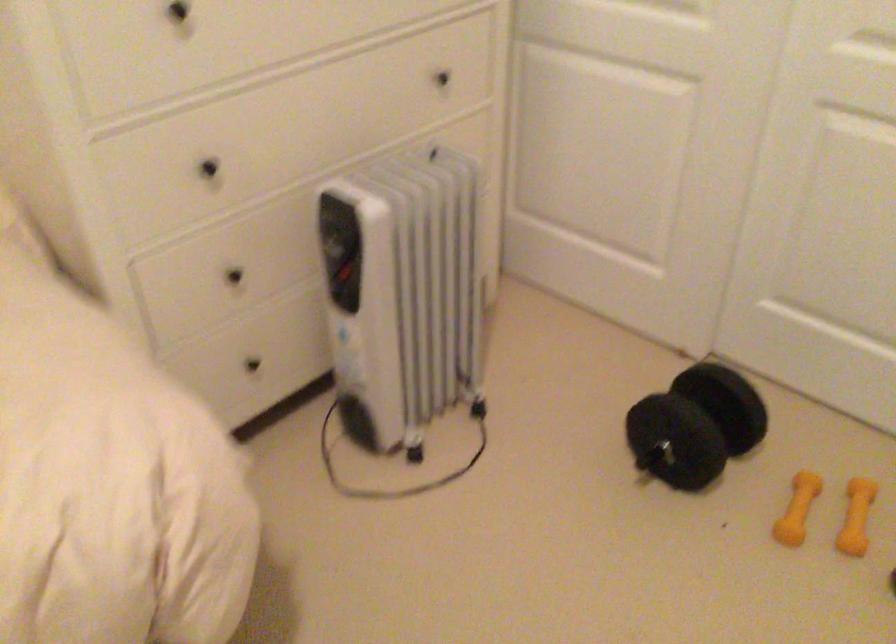
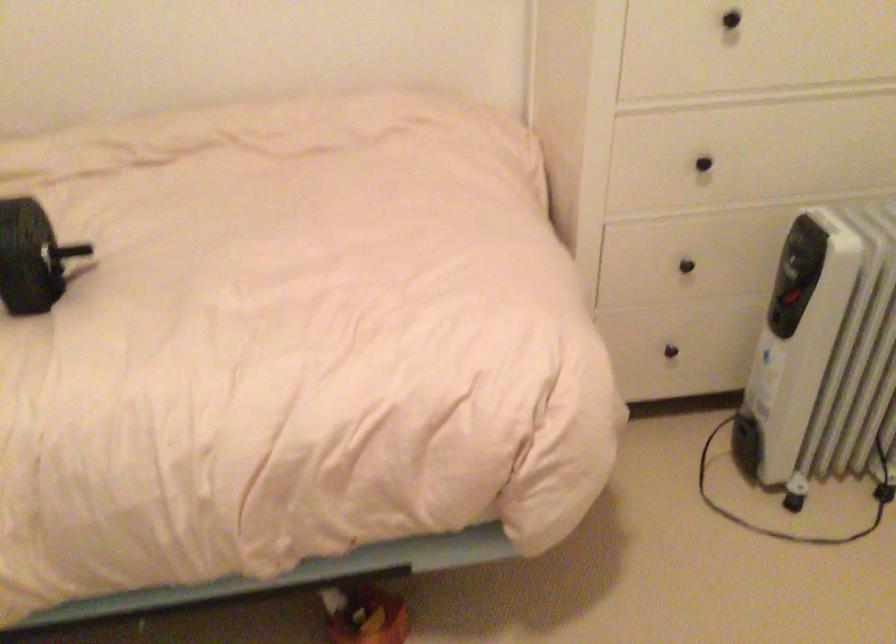
Locate, in the second image, the point that corresponds to pixel 416 456 in the first image.

(793, 502)